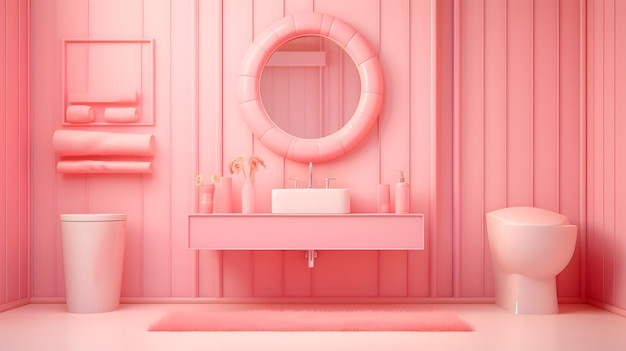
This screenshot has width=626, height=351. What are the coordinates of `sink` in the screenshot? It's located at (298, 203).